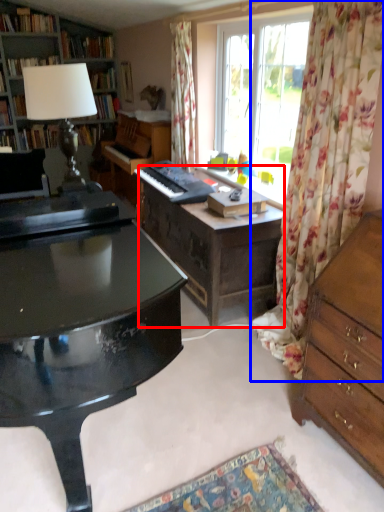
Question: Which object is closer to the camera taking this photo, vanity (highlighted by a red box) or curtain (highlighted by a blue box)?

Choices:
 (A) vanity
 (B) curtain

Answer: (B)